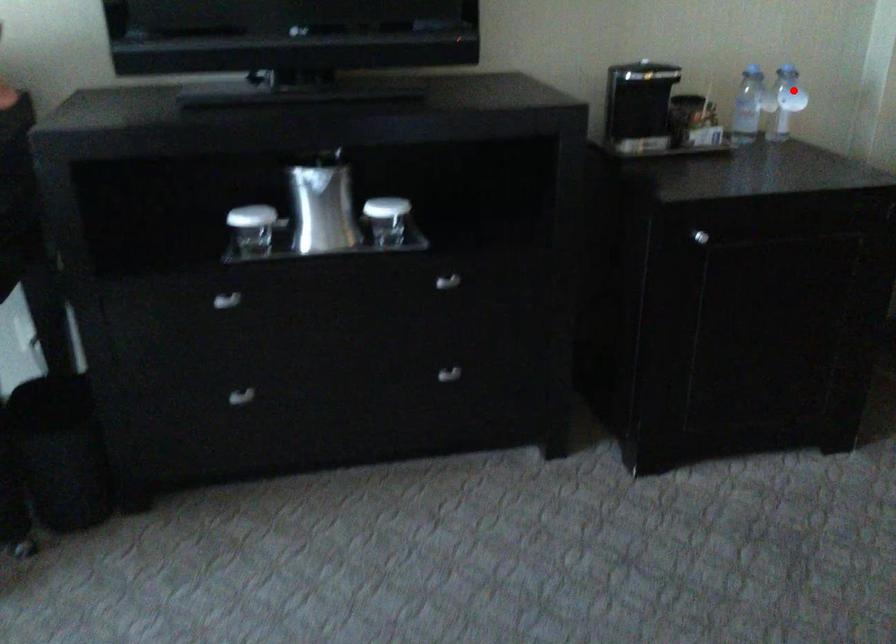
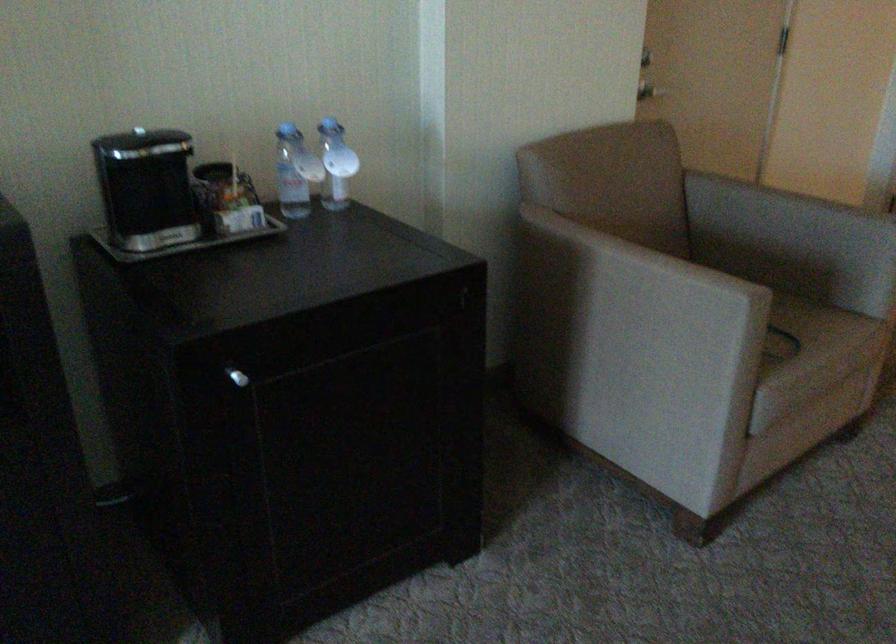
Locate, in the second image, the point that corresponds to the highlighted location in the first image.

(336, 164)